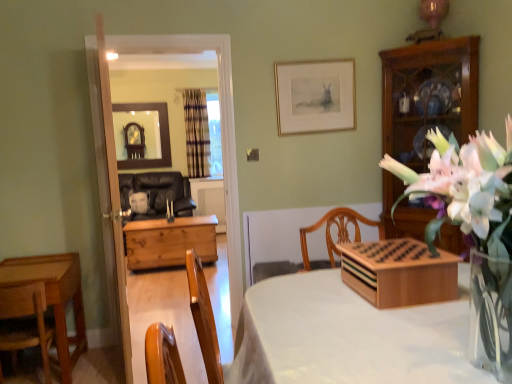
Question: Should I look upward or downward to see wooden chest at center?

Choices:
 (A) up
 (B) down

Answer: (B)

Question: Is wooden game board at center turned away from plaid fabric curtain at center?

Choices:
 (A) no
 (B) yes

Answer: (A)

Question: Does wooden game board at center lie behind plaid fabric curtain at center?

Choices:
 (A) no
 (B) yes

Answer: (A)

Question: From a real-world perspective, is wooden game board at center on plaid fabric curtain at center?

Choices:
 (A) no
 (B) yes

Answer: (A)

Question: Does wooden game board at center appear on the left side of plaid fabric curtain at center?

Choices:
 (A) no
 (B) yes

Answer: (A)

Question: Does wooden game board at center have a greater width compared to plaid fabric curtain at center?

Choices:
 (A) yes
 (B) no

Answer: (A)

Question: Is wooden game board at center shorter than plaid fabric curtain at center?

Choices:
 (A) yes
 (B) no

Answer: (A)

Question: From a real-world perspective, is matte glass mirror at upper center physically below plaid fabric curtain at center?

Choices:
 (A) yes
 (B) no

Answer: (B)

Question: Is matte glass mirror at upper center completely or partially outside of plaid fabric curtain at center?

Choices:
 (A) no
 (B) yes

Answer: (B)

Question: From a real-world perspective, is matte glass mirror at upper center over plaid fabric curtain at center?

Choices:
 (A) no
 (B) yes

Answer: (B)

Question: Is matte glass mirror at upper center aimed at plaid fabric curtain at center?

Choices:
 (A) yes
 (B) no

Answer: (B)

Question: Does matte glass mirror at upper center appear on the left side of plaid fabric curtain at center?

Choices:
 (A) yes
 (B) no

Answer: (A)

Question: Considering the relative sizes of matte glass mirror at upper center and plaid fabric curtain at center in the image provided, is matte glass mirror at upper center bigger than plaid fabric curtain at center?

Choices:
 (A) no
 (B) yes

Answer: (A)

Question: From the image's perspective, is wooden chest at center above wooden game board at center?

Choices:
 (A) no
 (B) yes

Answer: (A)